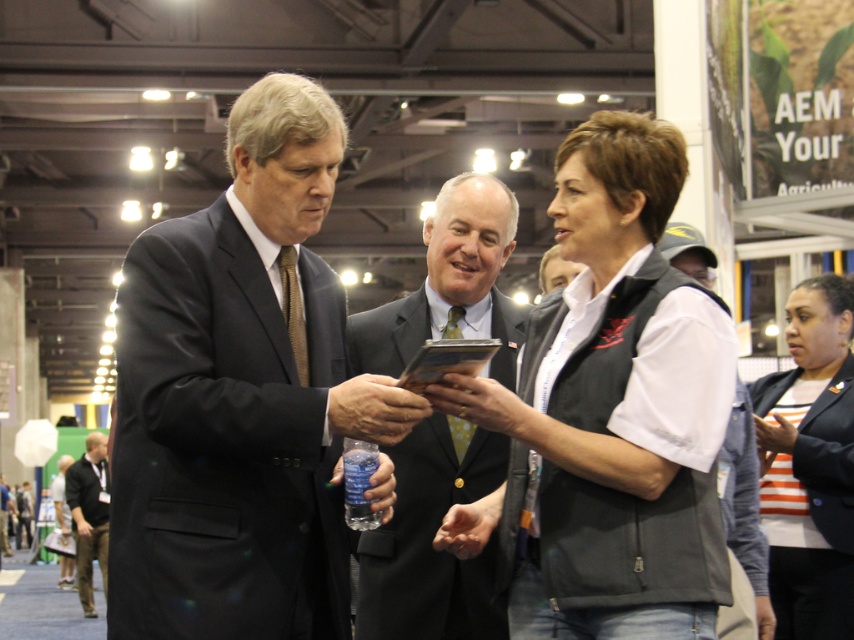
You are an event planner organizing a networking session. You need to arrange seating so that the matte black suit at center and the dark gray suit at center can see each other clearly. Based on their current positions, which one should be seated closer to the front of the room?

The matte black suit at center should be seated closer to the front of the room because it is already positioned in front of the dark gray suit at center, indicating it is closer to the front.